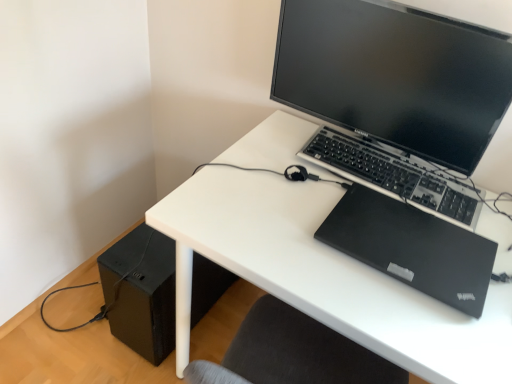
Locate an element on the screen. The width and height of the screenshot is (512, 384). empty space that is ontop of black matte laptop at upper right (from a real-world perspective) is located at coordinates (411, 238).